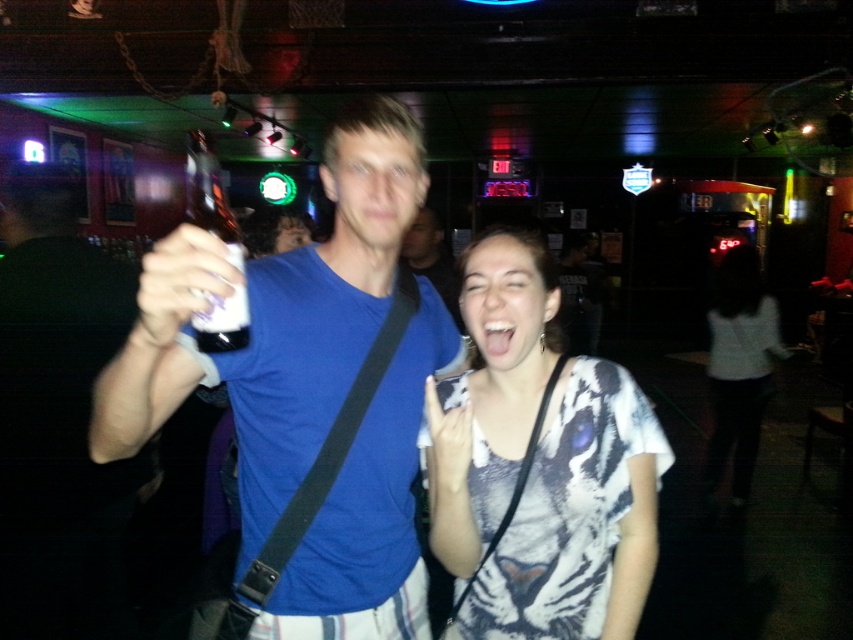
Which is below, white tiger print shirt at center or blue cotton shirt at center?

white tiger print shirt at center is lower down.

Measure the distance between white tiger print shirt at center and camera.

They are 3.76 feet apart.

Is point (665, 458) farther from viewer compared to point (460, 326)?

No, (665, 458) is in front of (460, 326).

Find the location of a particular element. white tiger print shirt at center is located at coordinates (538, 465).

Is white tiger print shirt at center thinner than white matte shirt at lower right?

Yes.

From the picture: Is white tiger print shirt at center further to the viewer compared to white matte shirt at lower right?

No, white tiger print shirt at center is in front of white matte shirt at lower right.

Is point (454, 499) closer to viewer compared to point (753, 340)?

Yes, point (454, 499) is closer to viewer.

This screenshot has height=640, width=853. In order to click on white tiger print shirt at center in this screenshot , I will do `click(538, 465)`.

Is point (761, 301) more distant than point (206, 221)?

Yes, point (761, 301) is farther from viewer.

Does white matte shirt at lower right appear over clear plastic bottle at upper left?

No.

Is point (730, 248) closer to camera compared to point (194, 321)?

No, (730, 248) is further to viewer.

Locate an element on the screen. white matte shirt at lower right is located at coordinates (740, 365).